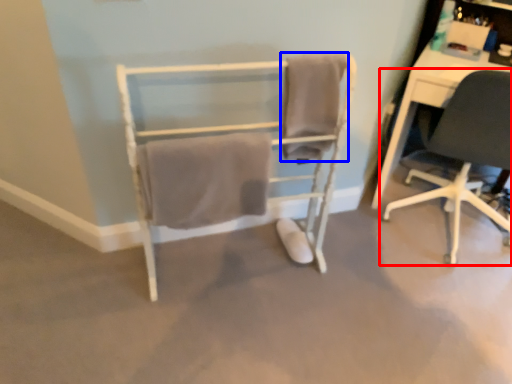
Question: Which of the following is the closest to the observer, chair (highlighted by a red box) or bath towel (highlighted by a blue box)?

Choices:
 (A) chair
 (B) bath towel

Answer: (B)